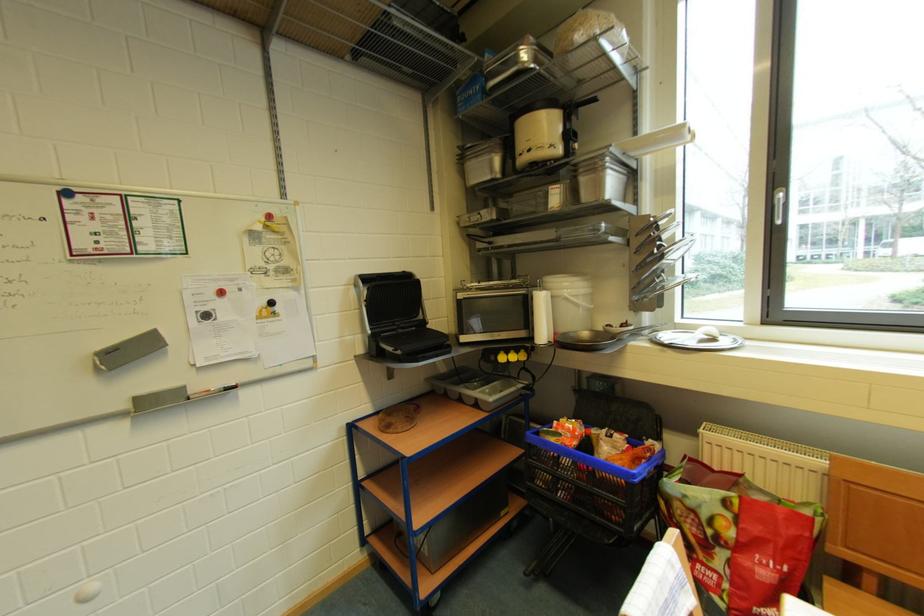
Describe the element at coordinates (670, 249) in the screenshot. Image resolution: width=924 pixels, height=616 pixels. I see `the metal spatula` at that location.